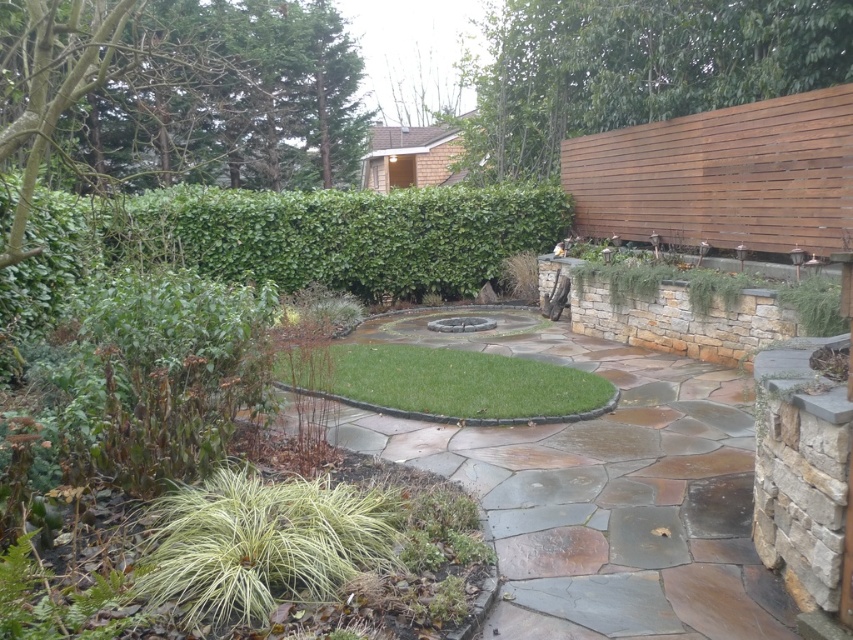
Question: Which of the following is the closest to the observer?

Choices:
 (A) green stone path at center
 (B) green leafy hedge at center
 (C) green grass at center
 (D) green grass at lower left

Answer: (D)

Question: Is green grass at lower left to the right of green grass at center from the viewer's perspective?

Choices:
 (A) no
 (B) yes

Answer: (A)

Question: Estimate the real-world distances between objects in this image. Which object is closer to the green grass at center?

Choices:
 (A) green leafy hedge at center
 (B) green stone path at center

Answer: (B)

Question: Where is green leafy hedge at center located in relation to green grass at center in the image?

Choices:
 (A) left
 (B) right

Answer: (B)

Question: Among these points, which one is farthest from the camera?

Choices:
 (A) (722, 484)
 (B) (323, 490)

Answer: (A)

Question: Does green leafy hedge at center appear over green grass at center?

Choices:
 (A) yes
 (B) no

Answer: (A)